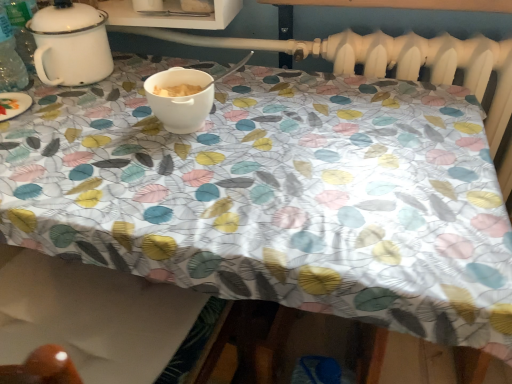
The image size is (512, 384). What do you see at coordinates (70, 44) in the screenshot? I see `white enamel pot at upper left` at bounding box center [70, 44].

Where is `white enamel pot at upper left`? The width and height of the screenshot is (512, 384). white enamel pot at upper left is located at coordinates (70, 44).

Image resolution: width=512 pixels, height=384 pixels. Find the location of `white matte bowl at center`. white matte bowl at center is located at coordinates (180, 100).

What is the approximate height of white matte bowl at center?

white matte bowl at center is 3.34 inches tall.

This screenshot has width=512, height=384. Describe the element at coordinates (180, 100) in the screenshot. I see `white matte bowl at center` at that location.

The image size is (512, 384). Find the location of `white enamel pot at upper left`. white enamel pot at upper left is located at coordinates (70, 44).

Which object is positioned more to the left, white matte bowl at center or white enamel pot at upper left?

Positioned to the left is white enamel pot at upper left.

Which is behind, white matte bowl at center or white enamel pot at upper left?

white enamel pot at upper left is further away from the camera.

Is point (194, 103) closer or farther from the camera than point (69, 35)?

Clearly, point (194, 103) is closer to the camera than point (69, 35).

From the image's perspective, which object appears higher, white matte bowl at center or white enamel pot at upper left?

white enamel pot at upper left is shown above in the image.

From a real-world perspective, between white matte bowl at center and white enamel pot at upper left, who is vertically lower?

white matte bowl at center is physically lower.

In terms of width, does white matte bowl at center look wider or thinner when compared to white enamel pot at upper left?

white matte bowl at center is thinner than white enamel pot at upper left.

Is white matte bowl at center shorter than white enamel pot at upper left?

Correct, white matte bowl at center is not as tall as white enamel pot at upper left.

Does white matte bowl at center have a larger size compared to white enamel pot at upper left?

No.

Choose the correct answer: Is white matte bowl at center inside white enamel pot at upper left or outside it?

white matte bowl at center is spatially situated outside white enamel pot at upper left.

Is white matte bowl at center beside white enamel pot at upper left?

There is a gap between white matte bowl at center and white enamel pot at upper left.

Is white matte bowl at center turned away from white enamel pot at upper left?

No.

How many degrees apart are the facing directions of white matte bowl at center and white enamel pot at upper left?

0.00076 degrees.

At what (x,y) coordinates should I click in order to perform the action: click on tableware that appears above the white matte bowl at center (from the image's perspective). Please return your answer as a coordinate pair (x, y). Image resolution: width=512 pixels, height=384 pixels. Looking at the image, I should click on (70, 44).

Which object is positioned more to the left, white enamel pot at upper left or white matte bowl at center?

white enamel pot at upper left is more to the left.

Is white enamel pot at upper left positioned in front of white matte bowl at center?

No, it is not.

Is point (91, 7) closer or farther from the camera than point (182, 80)?

Point (91, 7) is positioned farther from the camera compared to point (182, 80).

Consider the image. From the image's perspective, would you say white enamel pot at upper left is positioned over white matte bowl at center?

Correct, white enamel pot at upper left appears higher than white matte bowl at center in the image.

From a real-world perspective, between white enamel pot at upper left and white matte bowl at center, who is vertically higher?

white enamel pot at upper left, from a real-world perspective.

Is white enamel pot at upper left wider or thinner than white matte bowl at center?

Clearly, white enamel pot at upper left has more width compared to white matte bowl at center.

Considering the sizes of objects white enamel pot at upper left and white matte bowl at center in the image provided, who is taller, white enamel pot at upper left or white matte bowl at center?

white enamel pot at upper left is taller.

Can you confirm if white enamel pot at upper left is bigger than white matte bowl at center?

Indeed, white enamel pot at upper left has a larger size compared to white matte bowl at center.

Is white enamel pot at upper left not inside white matte bowl at center?

Yes.

Is white enamel pot at upper left next to white matte bowl at center?

No, white enamel pot at upper left is not with white matte bowl at center.

Is white enamel pot at upper left oriented towards white matte bowl at center?

No, white enamel pot at upper left is not oriented towards white matte bowl at center.

What's the angular difference between white enamel pot at upper left and white matte bowl at center's facing directions?

The facing directions of white enamel pot at upper left and white matte bowl at center are 0.00076 degrees apart.

Find the location of a particular element. The width and height of the screenshot is (512, 384). tableware behind the white matte bowl at center is located at coordinates (70, 44).

The image size is (512, 384). In order to click on tableware above the white matte bowl at center (from a real-world perspective) in this screenshot , I will do `click(70, 44)`.

Identify the location of tableware lying above the white matte bowl at center (from the image's perspective). The width and height of the screenshot is (512, 384). (70, 44).